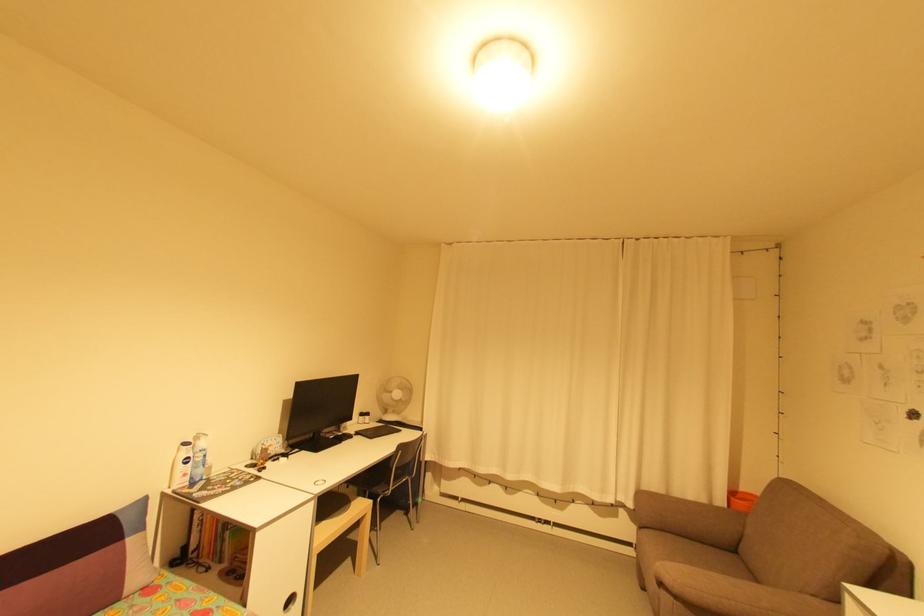
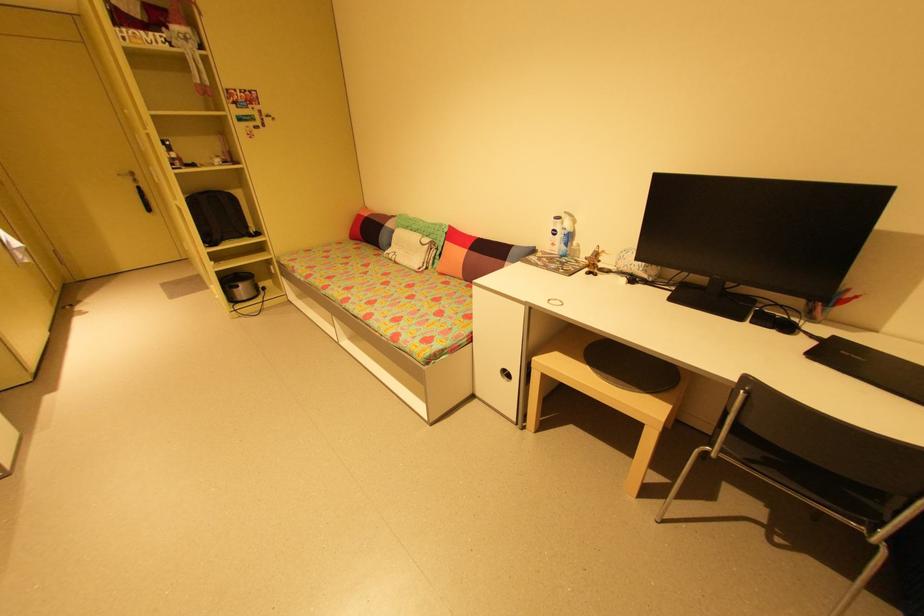
Locate, in the second image, the point that corresponds to (210,456) in the first image.

(574, 237)